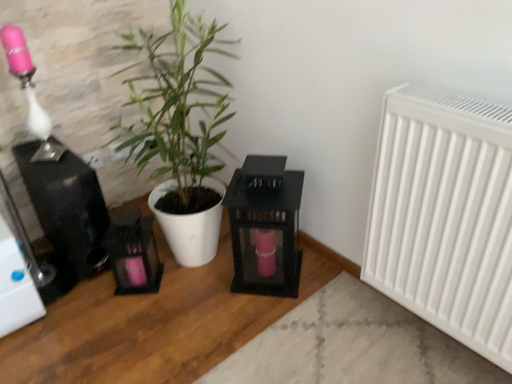
In order to click on vacant area that is in front of white matte plant pot at center in this screenshot , I will do `click(179, 326)`.